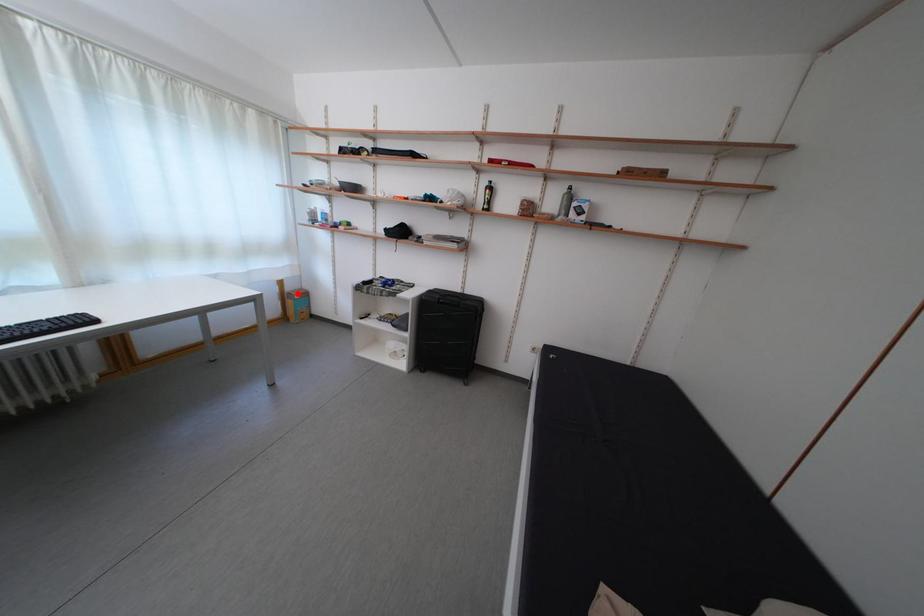
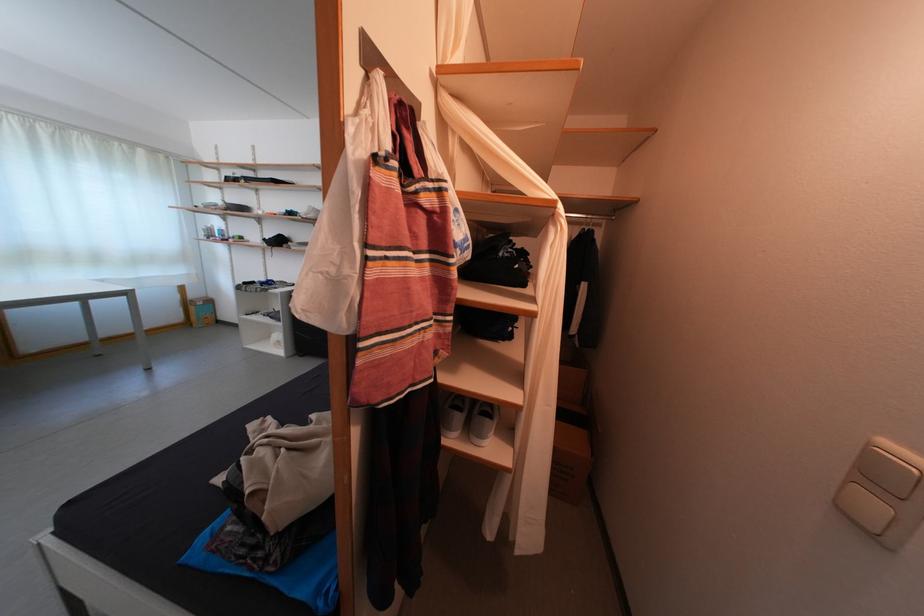
In the second image, find the point that corresponds to the highlighted location in the first image.

(201, 302)